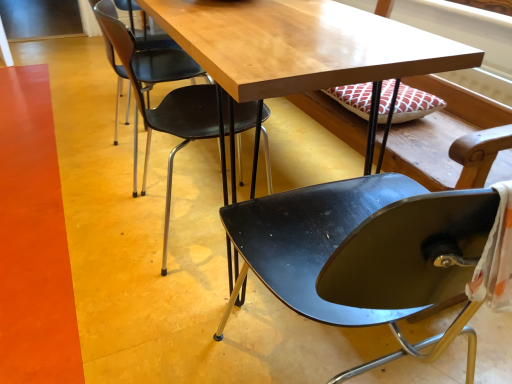
Identify the location of free location to the left of wooden table at center. (72, 168).